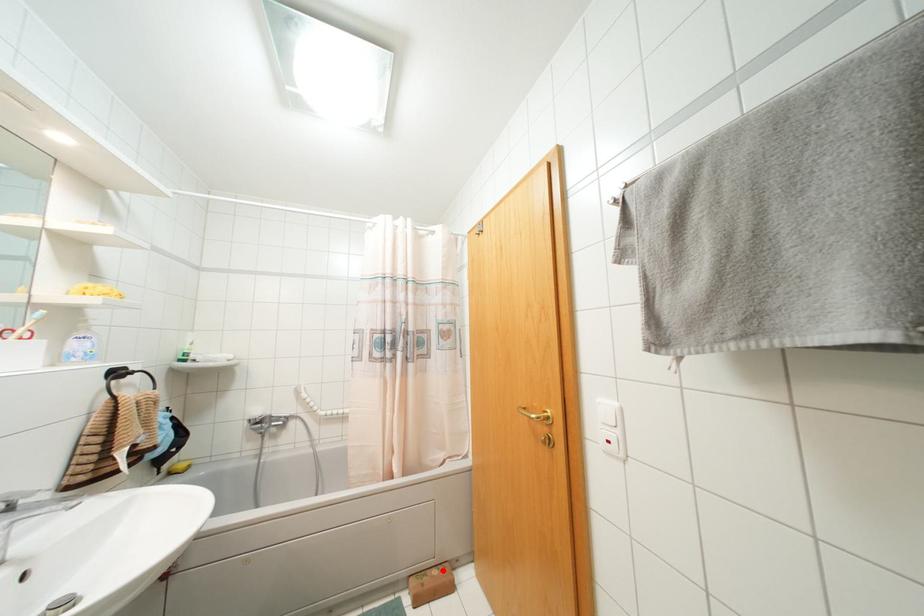
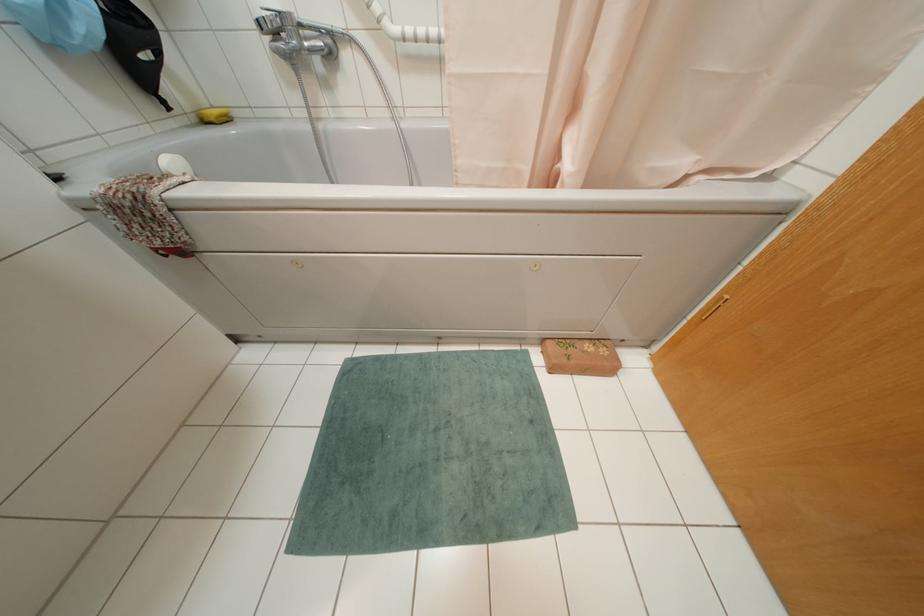
Where in the second image is the point corresponding to the highlighted location from the first image?

(602, 351)